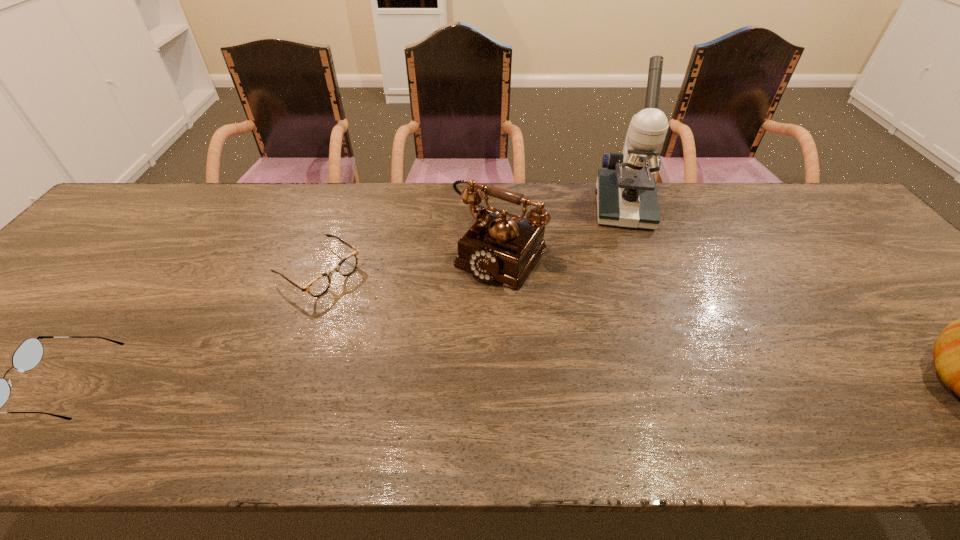
What are the coordinates of `free space located 0.090m on the dial of the fourth shortest object` in the screenshot? It's located at (460, 308).

The height and width of the screenshot is (540, 960). I want to click on free location located 0.300m on the dial of the fourth shortest object, so click(409, 374).

At what (x,y) coordinates should I click in order to perform the action: click on free space located 0.310m at the eyepiece of the second object from right to left. Please return your answer as a coordinate pair (x, y). The height and width of the screenshot is (540, 960). Looking at the image, I should click on (637, 313).

The height and width of the screenshot is (540, 960). Find the location of `blank space located 0.080m at the eyepiece of the second object from right to left`. blank space located 0.080m at the eyepiece of the second object from right to left is located at coordinates (630, 250).

You are a GUI agent. You are given a task and a screenshot of the screen. Output one action in this format:
    pyautogui.click(x=<x>, y=<y>)
    Task: Click on the vacant space situated at the eyepiece of the second object from right to left
    
    Given the screenshot: What is the action you would take?
    pyautogui.click(x=629, y=243)

Locate an element on the screen. This screenshot has width=960, height=540. telephone positioned at the far edge is located at coordinates (500, 246).

Find the location of a particular element. The height and width of the screenshot is (540, 960). microscope positioned at the far edge is located at coordinates (626, 192).

The height and width of the screenshot is (540, 960). In the image, there is a desktop. In order to click on vacant space at the far edge in this screenshot , I will do `click(207, 230)`.

In the image, there is a desktop. Identify the location of vacant space at the near edge. [x=276, y=396].

Identify the location of free space at the far left corner. This screenshot has height=540, width=960. (150, 198).